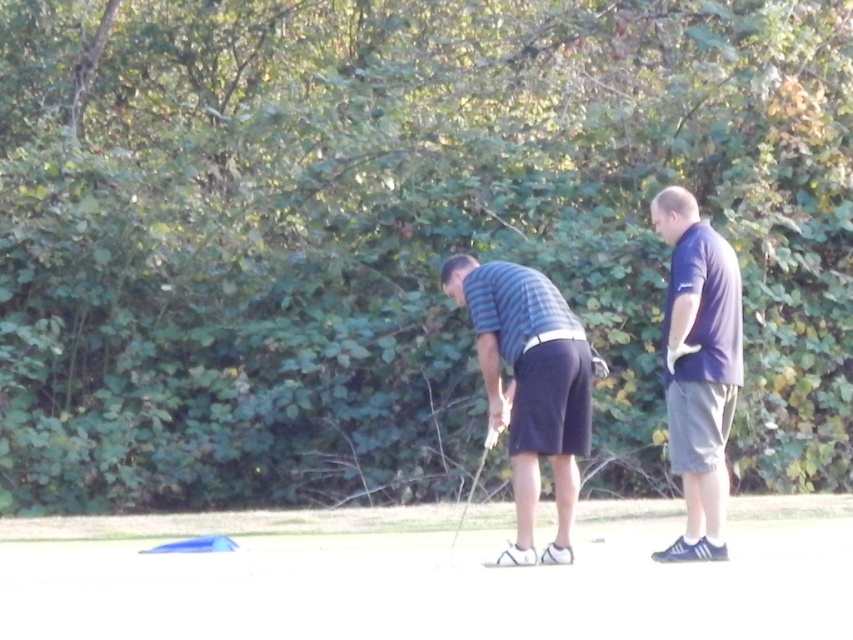
Which is behind, point (337, 612) or point (537, 452)?

The point (537, 452) is behind.

Measure the distance between white smooth sand at lower center and striped cotton shirt at center.

white smooth sand at lower center and striped cotton shirt at center are 2.42 meters apart from each other.

Is point (212, 579) in front of point (527, 522)?

No.

You are a GUI agent. You are given a task and a screenshot of the screen. Output one action in this format:
    pyautogui.click(x=<x>, y=<y>)
    Task: Click on the white smooth sand at lower center
    
    Given the screenshot: What is the action you would take?
    pyautogui.click(x=433, y=577)

Can you confirm if white smooth sand at lower center is bigger than metallic silver golf club at center?

Yes, white smooth sand at lower center is bigger than metallic silver golf club at center.

Which is below, white smooth sand at lower center or metallic silver golf club at center?

white smooth sand at lower center is below.

Is point (747, 515) positioned behind point (471, 493)?

No, (747, 515) is in front of (471, 493).

This screenshot has width=853, height=640. Find the location of `white smooth sand at lower center`. white smooth sand at lower center is located at coordinates 433,577.

How distant is striped cotton shirt at center from metallic silver golf club at center?

The distance of striped cotton shirt at center from metallic silver golf club at center is 3.39 feet.

Between striped cotton shirt at center and metallic silver golf club at center, which one is positioned higher?

Positioned higher is striped cotton shirt at center.

Is point (502, 413) positioned in front of point (491, 442)?

No, it is not.

The width and height of the screenshot is (853, 640). Identify the location of striped cotton shirt at center. (529, 387).